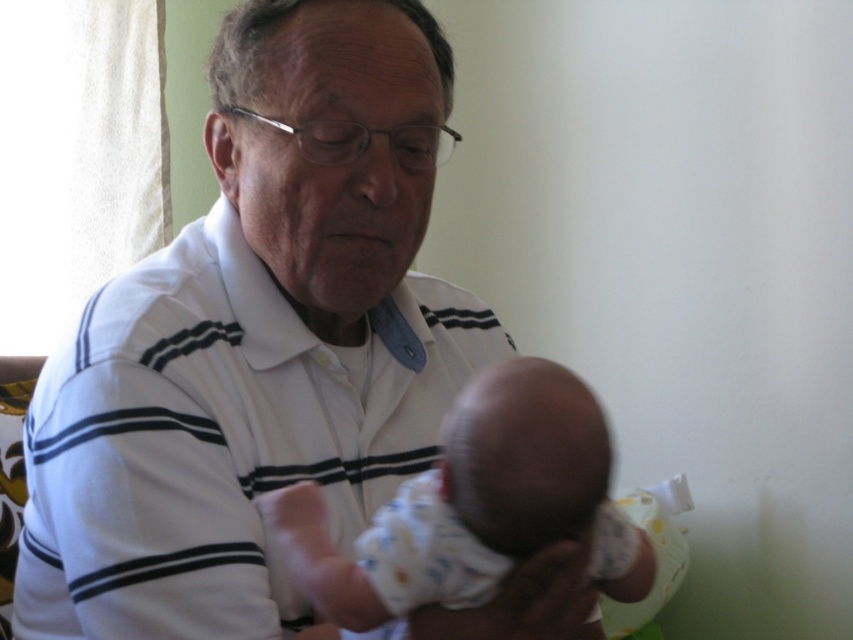
Question: Which point is farther to the camera?

Choices:
 (A) [x=421, y=125]
 (B) [x=538, y=417]

Answer: (A)

Question: Considering the relative positions of white striped shirt at center and white cotton baby at center in the image provided, where is white striped shirt at center located with respect to white cotton baby at center?

Choices:
 (A) right
 (B) left

Answer: (B)

Question: Is white striped shirt at center in front of white cotton baby at center?

Choices:
 (A) yes
 (B) no

Answer: (B)

Question: Which point is closer to the camera?

Choices:
 (A) (347, 24)
 (B) (532, 376)

Answer: (B)

Question: Is white striped shirt at center to the left of white cotton baby at center from the viewer's perspective?

Choices:
 (A) yes
 (B) no

Answer: (A)

Question: Which object appears closest to the camera in this image?

Choices:
 (A) white cotton baby at center
 (B) white striped shirt at center

Answer: (A)